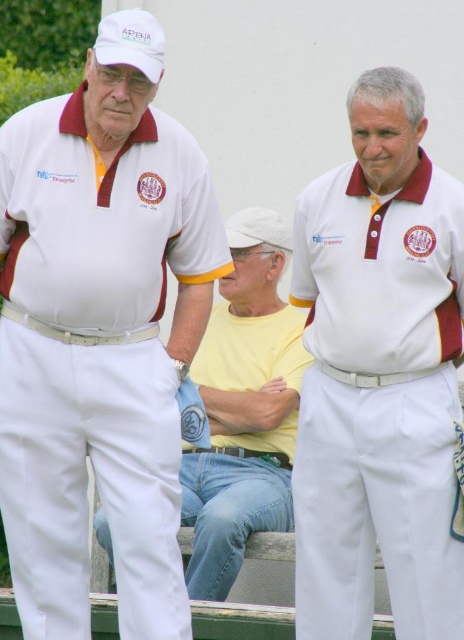
What do you see at coordinates (379, 376) in the screenshot? I see `white cotton polo shirt at center` at bounding box center [379, 376].

Does white cotton polo shirt at center lie behind yellow cotton shirt at center?

No, white cotton polo shirt at center is closer to the viewer.

Between point (430, 356) and point (210, 356), which one is positioned in front?

Point (430, 356) is more forward.

Locate an element on the screen. This screenshot has height=640, width=464. white cotton polo shirt at center is located at coordinates (379, 376).

How far apart are white cotton polo shirt at center and white matte polo shirt at center?

white cotton polo shirt at center and white matte polo shirt at center are 4.47 inches apart.

Is white cotton polo shirt at center wider than white matte polo shirt at center?

In fact, white cotton polo shirt at center might be narrower than white matte polo shirt at center.

Find the location of `white cotton polo shirt at center`. white cotton polo shirt at center is located at coordinates (379, 376).

Who is taller, white cotton polo shirt at left or white matte polo shirt at center?

white cotton polo shirt at left

The height and width of the screenshot is (640, 464). What do you see at coordinates (100, 333) in the screenshot?
I see `white cotton polo shirt at left` at bounding box center [100, 333].

Is point (102, 188) more distant than point (321, 352)?

No.

The image size is (464, 640). Find the location of `white cotton polo shirt at left`. white cotton polo shirt at left is located at coordinates (100, 333).